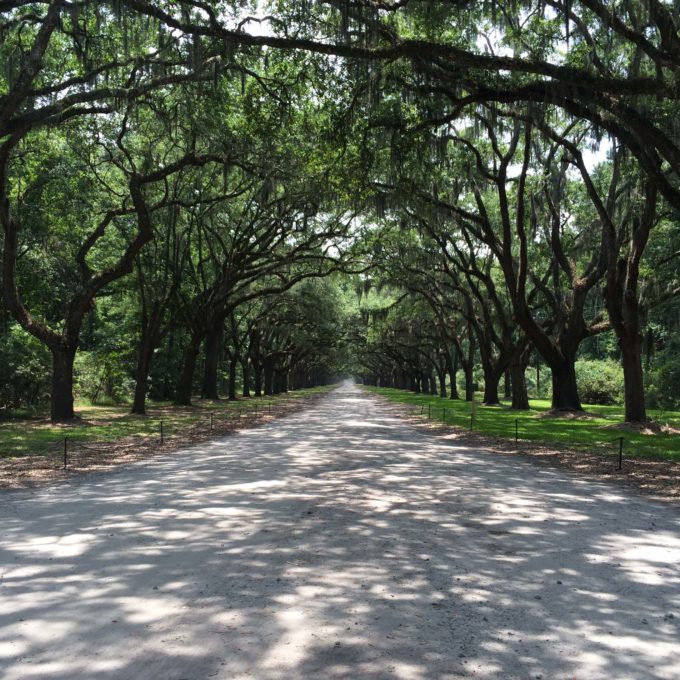
Find the location of `shade`. shade is located at coordinates (469, 611), (216, 573), (73, 515), (357, 462), (615, 515).